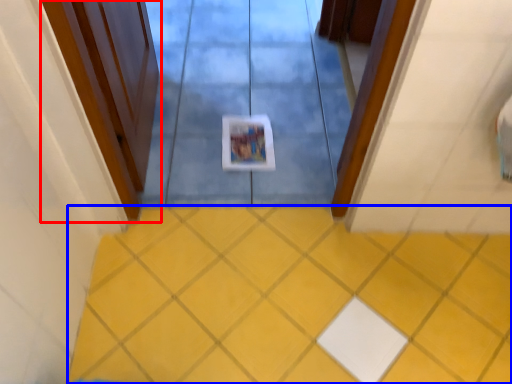
Question: Which point is closer to the camera, door (highlighted by a red box) or ceramic tile (highlighted by a blue box)?

Choices:
 (A) door
 (B) ceramic tile

Answer: (A)